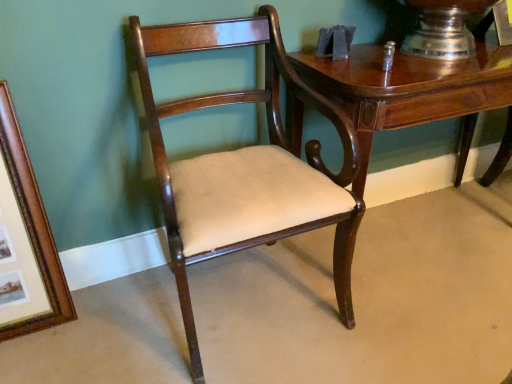
What is the approximate width of mahogany wood chair at center?

The width of mahogany wood chair at center is 21.72 inches.

The image size is (512, 384). Identify the location of wooden picture frame at left. (26, 241).

What are the coordinates of `glossy wood table at upper right` in the screenshot? It's located at (414, 94).

This screenshot has width=512, height=384. Describe the element at coordinates (414, 94) in the screenshot. I see `glossy wood table at upper right` at that location.

Identify the location of mahogany wood chair at center. This screenshot has width=512, height=384. (246, 165).

Can you confirm if glossy wood table at upper right is shorter than wooden picture frame at left?

Correct, glossy wood table at upper right is not as tall as wooden picture frame at left.

Where is `table located above the wooden picture frame at left (from the image's perspective)`? The width and height of the screenshot is (512, 384). table located above the wooden picture frame at left (from the image's perspective) is located at coordinates (414, 94).

From a real-world perspective, is glossy wood table at upper right over wooden picture frame at left?

No, from a real-world perspective, glossy wood table at upper right is not on top of wooden picture frame at left.

Considering the sizes of glossy wood table at upper right and mahogany wood chair at center in the image, is glossy wood table at upper right bigger or smaller than mahogany wood chair at center?

Considering their sizes, glossy wood table at upper right takes up more space than mahogany wood chair at center.

Could you tell me if glossy wood table at upper right is turned towards mahogany wood chair at center?

No, glossy wood table at upper right is not oriented towards mahogany wood chair at center.

Consider the image. Is glossy wood table at upper right to the left of mahogany wood chair at center from the viewer's perspective?

No, glossy wood table at upper right is not to the left of mahogany wood chair at center.

Between point (469, 103) and point (207, 103), which one is positioned in front?

The point (469, 103) is closer.

The height and width of the screenshot is (384, 512). I want to click on picture frame behind the mahogany wood chair at center, so click(26, 241).

Does point (40, 249) come behind point (155, 26)?

Yes, point (40, 249) is farther from viewer.

How many degrees apart are the facing directions of wooden picture frame at left and mahogany wood chair at center?

They differ by 0.869 degrees in their facing directions.

Is wooden picture frame at left closer to camera compared to mahogany wood chair at center?

That is False.

Is point (20, 331) more distant than point (469, 146)?

No, (20, 331) is closer to viewer.

From a real-world perspective, is wooden picture frame at left positioned above or below glossy wood table at upper right?

wooden picture frame at left is above glossy wood table at upper right.

Is wooden picture frame at left far from glossy wood table at upper right?

Actually, wooden picture frame at left and glossy wood table at upper right are a little close together.

How distant is wooden picture frame at left from glossy wood table at upper right?

wooden picture frame at left and glossy wood table at upper right are 38.76 inches apart.

Based on the photo, is the position of mahogany wood chair at center less distant than that of wooden picture frame at left?

Yes, it is.

Is mahogany wood chair at center bigger or smaller than wooden picture frame at left?

mahogany wood chair at center is bigger than wooden picture frame at left.

Based on the photo, does mahogany wood chair at center appear on the left side of wooden picture frame at left?

In fact, mahogany wood chair at center is to the right of wooden picture frame at left.

Which object is wider, mahogany wood chair at center or wooden picture frame at left?

With larger width is mahogany wood chair at center.

Is glossy wood table at upper right surrounded by mahogany wood chair at center?

No, glossy wood table at upper right is not surrounded by mahogany wood chair at center.

Measure the distance between mahogany wood chair at center and glossy wood table at upper right.

10.01 inches.

Which object is thinner, mahogany wood chair at center or glossy wood table at upper right?

glossy wood table at upper right.

Looking at this image, is mahogany wood chair at center behind glossy wood table at upper right?

No, it is in front of glossy wood table at upper right.

This screenshot has height=384, width=512. What are the coordinates of `picture frame lying below the glossy wood table at upper right (from the image's perspective)` in the screenshot? It's located at (26, 241).

Where is `table below the mahogany wood chair at center (from a real-world perspective)`? The width and height of the screenshot is (512, 384). table below the mahogany wood chair at center (from a real-world perspective) is located at coordinates (414, 94).

Looking at this image, which object lies nearer to the anchor point mahogany wood chair at center, wooden picture frame at left or glossy wood table at upper right?

glossy wood table at upper right is positioned closer to the anchor mahogany wood chair at center.

Based on their spatial positions, is glossy wood table at upper right or mahogany wood chair at center further from wooden picture frame at left?

glossy wood table at upper right is further to wooden picture frame at left.

Based on their spatial positions, is mahogany wood chair at center or glossy wood table at upper right further from wooden picture frame at left?

Based on the image, glossy wood table at upper right appears to be further to wooden picture frame at left.

Estimate the real-world distances between objects in this image. Which object is further from mahogany wood chair at center, glossy wood table at upper right or wooden picture frame at left?

wooden picture frame at left.

From the image, which object appears to be farther from glossy wood table at upper right, wooden picture frame at left or mahogany wood chair at center?

wooden picture frame at left is further to glossy wood table at upper right.

Considering their positions, is mahogany wood chair at center positioned further to glossy wood table at upper right than wooden picture frame at left?

wooden picture frame at left.

Locate an element on the screen. The height and width of the screenshot is (384, 512). chair situated between wooden picture frame at left and glossy wood table at upper right from left to right is located at coordinates (246, 165).